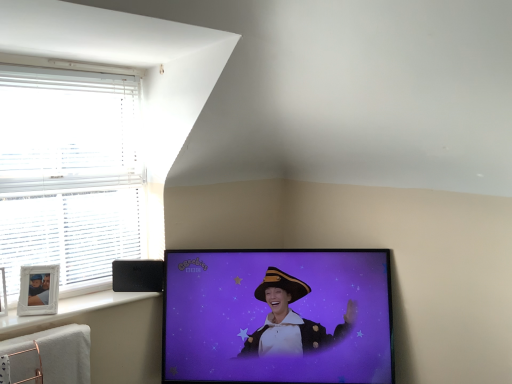
Question: Is point (159, 266) positioned closer to the camera than point (46, 327)?

Choices:
 (A) farther
 (B) closer

Answer: (A)

Question: In the image, is black plastic speaker at lower left positioned in front of or behind white plastic frame at lower left?

Choices:
 (A) behind
 (B) front

Answer: (A)

Question: Estimate the real-world distances between objects in this image. Which object is farther from the black glossy tv at center?

Choices:
 (A) black plastic speaker at lower left
 (B) white blinds at left
 (C) white plastic frame at lower left

Answer: (B)

Question: Which of these objects is positioned closest to the white plastic frame at lower left?

Choices:
 (A) black plastic speaker at lower left
 (B) black glossy tv at center
 (C) white blinds at left

Answer: (A)